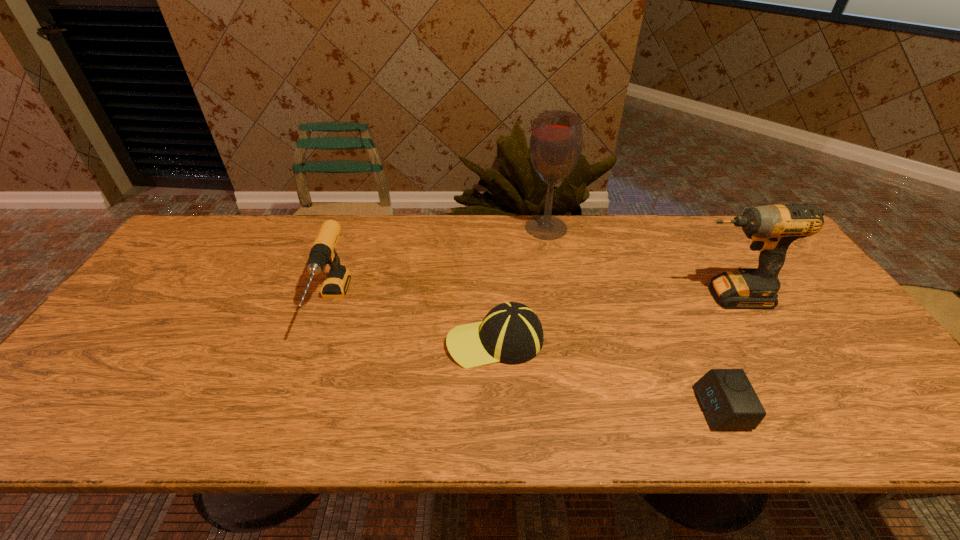
You are a GUI agent. You are given a task and a screenshot of the screen. Output one action in this format:
    pyautogui.click(x=<x>, y=<y>)
    Task: Click on the alcohol
    Image resolution: width=960 pixels, height=540 pixels.
    Given the screenshot: What is the action you would take?
    pyautogui.click(x=555, y=147)

Image resolution: width=960 pixels, height=540 pixels. I want to click on the tallest object, so click(555, 147).

What are the coordinates of `the taller drill` in the screenshot? It's located at (772, 228).

Image resolution: width=960 pixels, height=540 pixels. Identify the location of the right drill. (772, 228).

The width and height of the screenshot is (960, 540). Identify the location of the left drill. (336, 283).

The height and width of the screenshot is (540, 960). What are the coordinates of `the leftmost object` in the screenshot? It's located at (336, 283).

You are a GUI agent. You are given a task and a screenshot of the screen. Output one action in this format:
    pyautogui.click(x=<x>, y=<y>)
    Task: Click on the baseball cap
    
    Given the screenshot: What is the action you would take?
    pyautogui.click(x=511, y=332)

I want to click on the nearest object, so click(x=729, y=402).

The image size is (960, 540). In order to click on the shortest object in this screenshot , I will do `click(729, 402)`.

Image resolution: width=960 pixels, height=540 pixels. What are the coordinates of `free space located 0.080m on the front of the farthest object` in the screenshot? It's located at 552,257.